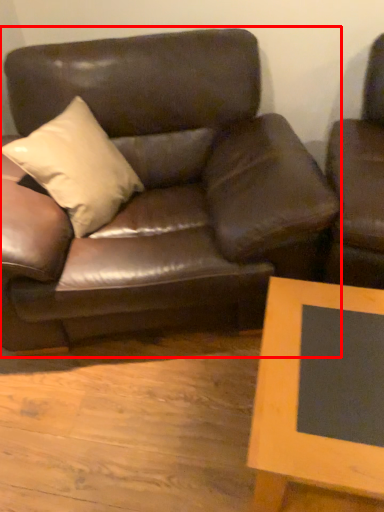
Question: Observing the image, what is the correct spatial positioning of studio couch (annotated by the red box) in reference to table?

Choices:
 (A) left
 (B) right

Answer: (A)